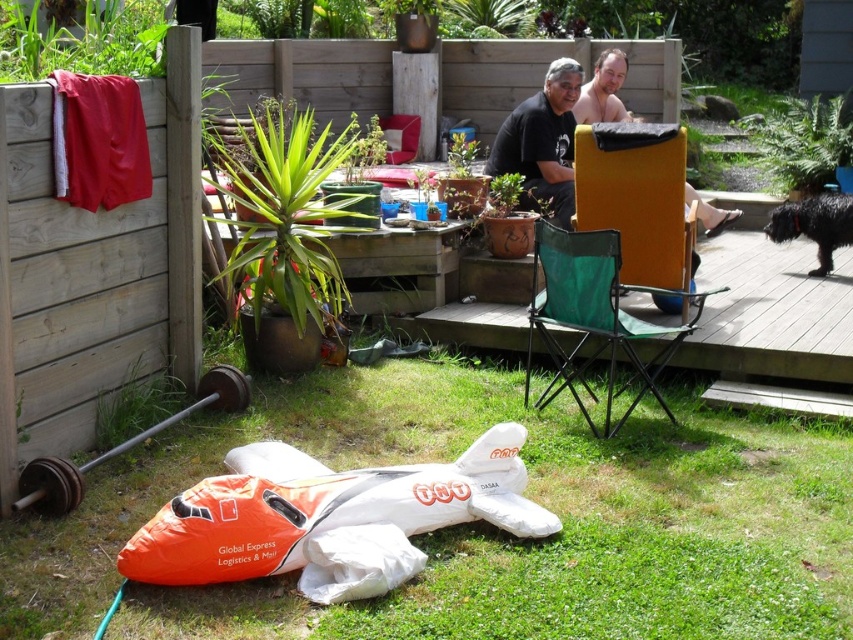
You are planning to host a small gathering and need to seat 4 people comfortably. The wooden deck at center and yellow fabric chair at upper right are available. Can both accommodate all guests without overlapping?

The wooden deck at center has a larger size compared to yellow fabric chair at upper right, so it can accommodate more people. However, the yellow fabric chair at upper right is likely only for one person. Together, they can seat up to 5 people if the deck holds 4 and the chair 1, but the question asks for 4. Thus, yes, they can accommodate all guests without overlapping.

You are sitting on the grass in the backyard and want to move to a higher seat. Which chair should you choose between the green mesh chair at center and the yellow fabric chair at upper right?

The yellow fabric chair at upper right is taller than the green mesh chair at center, so you should choose the yellow fabric chair at upper right to reach a higher seat.

You are sitting on the wooden deck at center and want to move to the yellow fabric chair at upper right. Which direction should you move to reach it?

The wooden deck at center is positioned on the right side of yellow fabric chair at upper right. To reach the yellow fabric chair at upper right, you should move to the left.